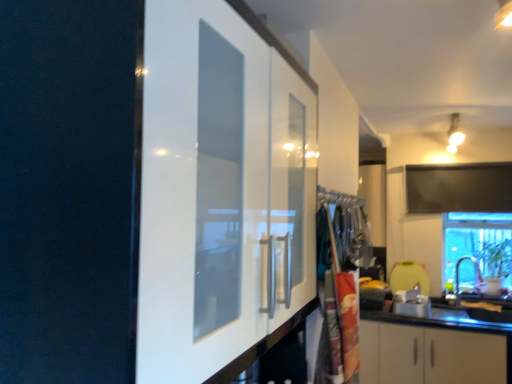
Measure the distance between transparent glass window at lower right and camera.

The depth of transparent glass window at lower right is 10.80 feet.

The height and width of the screenshot is (384, 512). What do you see at coordinates (478, 243) in the screenshot? I see `transparent glass window at lower right` at bounding box center [478, 243].

At what (x,y) coordinates should I click in order to perform the action: click on matte silver sink at lower right. Please return your answer as a coordinate pair (x, y). The width and height of the screenshot is (512, 384). Looking at the image, I should click on point(459,284).

How different are the orientations of matte silver sink at lower right and polyester laundry bag at center in degrees?

The angle between the facing direction of matte silver sink at lower right and the facing direction of polyester laundry bag at center is 3.15 degrees.

Can you confirm if matte silver sink at lower right is positioned to the right of polyester laundry bag at center?

Indeed, matte silver sink at lower right is positioned on the right side of polyester laundry bag at center.

Is the surface of matte silver sink at lower right in direct contact with polyester laundry bag at center?

matte silver sink at lower right and polyester laundry bag at center are clearly separated.

From a real-world perspective, relative to polyester laundry bag at center, is matte silver sink at lower right vertically above or below?

matte silver sink at lower right is situated lower than polyester laundry bag at center in the real world.

Based on their positions, is transparent glass window at lower right located to the left or right of polyester laundry bag at center?

transparent glass window at lower right is positioned on polyester laundry bag at center's right side.

Is transparent glass window at lower right placed right next to polyester laundry bag at center?

No, transparent glass window at lower right is not making contact with polyester laundry bag at center.

Can you tell me how much transparent glass window at lower right and polyester laundry bag at center differ in facing direction?

There is a 3.83-degree angle between the facing directions of transparent glass window at lower right and polyester laundry bag at center.

Considering the sizes of objects transparent glass window at lower right and polyester laundry bag at center in the image provided, who is thinner, transparent glass window at lower right or polyester laundry bag at center?

With smaller width is polyester laundry bag at center.

From the image's perspective, is polyester laundry bag at center above or below transparent glass window at lower right?

Clearly, from the image's perspective, polyester laundry bag at center is above transparent glass window at lower right.

Does polyester laundry bag at center turn towards transparent glass window at lower right?

No.

From a real-world perspective, who is located lower, polyester laundry bag at center or transparent glass window at lower right?

From a 3D spatial view, polyester laundry bag at center is below.

Could transparent glass window at lower right be considered to be inside matte silver sink at lower right?

No.

Locate an element on the screen. window above the matte silver sink at lower right (from a real-world perspective) is located at coordinates (478, 243).

Is matte silver sink at lower right shorter than transparent glass window at lower right?

Yes.

Is polyester laundry bag at center taller or shorter than matte silver sink at lower right?

In the image, polyester laundry bag at center appears to be taller than matte silver sink at lower right.

Is point (317, 230) closer or farther from the camera than point (454, 296)?

Point (317, 230) is closer to the camera than point (454, 296).

From a real-world perspective, is polyester laundry bag at center positioned above or below matte silver sink at lower right?

From a real-world perspective, polyester laundry bag at center is physically above matte silver sink at lower right.

Is transparent glass window at lower right completely or partially outside of matte silver sink at lower right?

Absolutely, transparent glass window at lower right is external to matte silver sink at lower right.

Considering the positions of objects transparent glass window at lower right and matte silver sink at lower right in the image provided, who is more to the left, transparent glass window at lower right or matte silver sink at lower right?

→ From the viewer's perspective, matte silver sink at lower right appears more on the left side.

Between transparent glass window at lower right and matte silver sink at lower right, which one has smaller width?

matte silver sink at lower right is thinner.

The width and height of the screenshot is (512, 384). I want to click on laundry above the matte silver sink at lower right (from the image's perspective), so tap(342, 268).

At what (x,y) coordinates should I click in order to perform the action: click on window on the right side of polyester laundry bag at center. Please return your answer as a coordinate pair (x, y). Looking at the image, I should click on (478, 243).

Considering their positions, is polyester laundry bag at center positioned further to matte silver sink at lower right than transparent glass window at lower right?

polyester laundry bag at center.

From the image, which object appears to be farther from polyester laundry bag at center, matte silver sink at lower right or transparent glass window at lower right?

Based on the image, matte silver sink at lower right appears to be further to polyester laundry bag at center.

Considering their positions, is matte silver sink at lower right positioned closer to transparent glass window at lower right than polyester laundry bag at center?

Among the two, matte silver sink at lower right is located nearer to transparent glass window at lower right.

Estimate the real-world distances between objects in this image. Which object is further from matte silver sink at lower right, transparent glass window at lower right or polyester laundry bag at center?

polyester laundry bag at center is positioned further to the anchor matte silver sink at lower right.

Estimate the real-world distances between objects in this image. Which object is closer to polyester laundry bag at center, transparent glass window at lower right or matte silver sink at lower right?

transparent glass window at lower right lies closer to polyester laundry bag at center than the other object.

Looking at the image, which one is located further to transparent glass window at lower right, polyester laundry bag at center or matte silver sink at lower right?

polyester laundry bag at center is further to transparent glass window at lower right.

Locate an element on the screen. sink between polyester laundry bag at center and transparent glass window at lower right in the front-back direction is located at coordinates (459, 284).